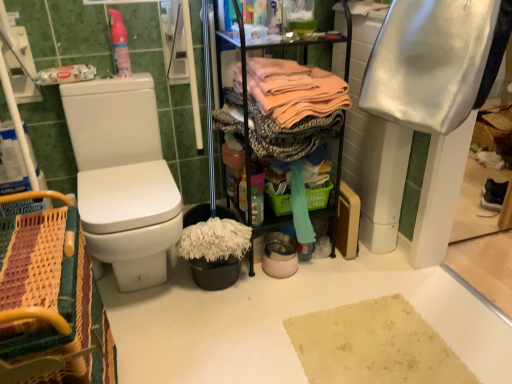
Based on the photo, in order to face woven wood picnic basket at lower left, should I rotate leftwards or rightwards?

To align with it, rotate left about 27.828°.

This screenshot has width=512, height=384. What do you see at coordinates (435, 61) in the screenshot? I see `white satin towel at upper right, which appears as the second clothing when viewed from the left` at bounding box center [435, 61].

What is the approximate height of green plastic basket at center?

green plastic basket at center is 4.36 inches tall.

What do you see at coordinates (318, 196) in the screenshot? I see `green plastic basket at center` at bounding box center [318, 196].

The width and height of the screenshot is (512, 384). What do you see at coordinates (215, 272) in the screenshot?
I see `black plastic bucket at lower center` at bounding box center [215, 272].

You are a GUI agent. You are given a task and a screenshot of the screen. Output one action in this format:
    pyautogui.click(x=<x>, y=<y>)
    Task: Click on the white glossy toilet at left
    This screenshot has width=512, height=384.
    Given the screenshot: What is the action you would take?
    pyautogui.click(x=123, y=178)

Image resolution: width=512 pixels, height=384 pixels. Identify the location of woven wood picnic basket at lower left. (44, 296).

Is white satin towel at upper right, the first clothing from the right, turned away from black plastic bucket at lower center?

white satin towel at upper right, the first clothing from the right, is not turned away from black plastic bucket at lower center.

Are white satin towel at upper right, the first clothing from the right, and black plastic bucket at lower center making contact?

Result: No.

Visually, is white satin towel at upper right, which appears as the second clothing when viewed from the left, positioned to the left or to the right of black plastic bucket at lower center?

In the image, white satin towel at upper right, which appears as the second clothing when viewed from the left, appears on the right side of black plastic bucket at lower center.

Which of these two, white satin towel at upper right, the first clothing from the right, or black plastic bucket at lower center, is bigger?

white satin towel at upper right, the first clothing from the right.

From a real-world perspective, is pink matte spray bottle at upper left above or below black plastic bucket at lower center?

pink matte spray bottle at upper left is situated higher than black plastic bucket at lower center in the real world.

From the image's perspective, which object appears higher, pink matte spray bottle at upper left or black plastic bucket at lower center?

pink matte spray bottle at upper left appears higher in the image.

Is pink matte spray bottle at upper left aimed at black plastic bucket at lower center?

No.

Does pink matte spray bottle at upper left turn towards woven wood picnic basket at lower left?

No, pink matte spray bottle at upper left is not aimed at woven wood picnic basket at lower left.

From the image's perspective, which object appears higher, pink matte spray bottle at upper left or woven wood picnic basket at lower left?

pink matte spray bottle at upper left is shown above in the image.

Find the location of a particular element. This screenshot has width=512, height=384. cleaning products that is above the woven wood picnic basket at lower left (from a real-world perspective) is located at coordinates (120, 44).

How far apart are pink matte spray bottle at upper left and woven wood picnic basket at lower left?

A distance of 38.00 inches exists between pink matte spray bottle at upper left and woven wood picnic basket at lower left.

In terms of size, does woven wood picnic basket at lower left appear bigger or smaller than green plastic basket at center?

Clearly, woven wood picnic basket at lower left is larger in size than green plastic basket at center.

Is green plastic basket at center surrounded by woven wood picnic basket at lower left?

No, green plastic basket at center is located outside of woven wood picnic basket at lower left.

Is green plastic basket at center outside of white glossy toilet at left?

Absolutely, green plastic basket at center is external to white glossy toilet at left.

Considering the sizes of objects green plastic basket at center and white glossy toilet at left in the image provided, who is smaller, green plastic basket at center or white glossy toilet at left?

green plastic basket at center.

From a real-world perspective, which object rests below the other?

green plastic basket at center is physically lower.

Are green plastic basket at center and white glossy toilet at left making contact?

No, green plastic basket at center is not in contact with white glossy toilet at left.

Identify the location of cleaning products above the pink fabric at center, which ranks as the first clothing in left-to-right order (from the image's perspective). This screenshot has height=384, width=512. (120, 44).

Does pink matte spray bottle at upper left have a greater width compared to pink fabric at center, marked as the second clothing in a right-to-left arrangement?

Incorrect, the width of pink matte spray bottle at upper left does not surpass that of pink fabric at center, marked as the second clothing in a right-to-left arrangement.

Is pink matte spray bottle at upper left next to pink fabric at center, which ranks as the first clothing in left-to-right order, and touching it?

No, pink matte spray bottle at upper left is not touching pink fabric at center, which ranks as the first clothing in left-to-right order.

Would you say pink fabric at center, which ranks as the first clothing in left-to-right order, is part of pink matte spray bottle at upper left's contents?

No, pink fabric at center, which ranks as the first clothing in left-to-right order, is not a part of pink matte spray bottle at upper left.

Is white matte toilet paper at left looking in the opposite direction of black plastic bucket at lower center?

That's not correct — white matte toilet paper at left is not looking away from black plastic bucket at lower center.

Considering the sizes of objects white matte toilet paper at left and black plastic bucket at lower center in the image provided, who is smaller, white matte toilet paper at left or black plastic bucket at lower center?

With smaller size is white matte toilet paper at left.

Does white matte toilet paper at left have a greater width compared to black plastic bucket at lower center?

In fact, white matte toilet paper at left might be narrower than black plastic bucket at lower center.

This screenshot has width=512, height=384. Identify the location of trash bin/can that is below the white satin towel at upper right, which appears as the second clothing when viewed from the left (from the image's perspective). (215, 272).

Where is `trash bin/can beneath the pink matte spray bottle at upper left (from a real-world perspective)`? The width and height of the screenshot is (512, 384). trash bin/can beneath the pink matte spray bottle at upper left (from a real-world perspective) is located at coordinates (215, 272).

Based on their spatial positions, is pink fabric at center, which ranks as the first clothing in left-to-right order, or black plastic bucket at lower center further from green plastic basket at center?

Among the two, pink fabric at center, which ranks as the first clothing in left-to-right order, is located further to green plastic basket at center.

From the image, which object appears to be farther from white glossy toilet at left, white matte toilet paper at left or green plastic basket at center?

Among the two, green plastic basket at center is located further to white glossy toilet at left.

Which object lies nearer to the anchor point green plastic basket at center, pink fabric at center, which ranks as the first clothing in left-to-right order, or pink matte spray bottle at upper left?

Among the two, pink fabric at center, which ranks as the first clothing in left-to-right order, is located nearer to green plastic basket at center.

Based on their spatial positions, is white matte toilet paper at left or green plastic basket at center further from pink matte spray bottle at upper left?

Among the two, green plastic basket at center is located further to pink matte spray bottle at upper left.

Estimate the real-world distances between objects in this image. Which object is closer to white matte toilet paper at left, white glossy toilet at left or pink fabric at center, which ranks as the first clothing in left-to-right order?

The object closer to white matte toilet paper at left is white glossy toilet at left.

Based on their spatial positions, is pink fabric at center, marked as the second clothing in a right-to-left arrangement, or pink matte spray bottle at upper left closer to white satin towel at upper right, which appears as the second clothing when viewed from the left?

Among the two, pink fabric at center, marked as the second clothing in a right-to-left arrangement, is located nearer to white satin towel at upper right, which appears as the second clothing when viewed from the left.

From the image, which object appears to be farther from white glossy toilet at left, woven wood picnic basket at lower left or white satin towel at upper right, the first clothing from the right?

white satin towel at upper right, the first clothing from the right.

Considering their positions, is pink matte spray bottle at upper left positioned closer to white glossy toilet at left than woven wood picnic basket at lower left?

pink matte spray bottle at upper left.

Find the location of a particular element. This screenshot has width=512, height=384. basket situated between black plastic bucket at lower center and white satin towel at upper right, which appears as the second clothing when viewed from the left, from left to right is located at coordinates (318, 196).

I want to click on toilet between pink matte spray bottle at upper left and pink fabric at center, which ranks as the first clothing in left-to-right order, from left to right, so click(x=123, y=178).

Identify the location of cleaning products located between woven wood picnic basket at lower left and white satin towel at upper right, which appears as the second clothing when viewed from the left, in the left-right direction. (120, 44).

The image size is (512, 384). I want to click on basket between pink fabric at center, which ranks as the first clothing in left-to-right order, and black plastic bucket at lower center in the up-down direction, so point(318,196).